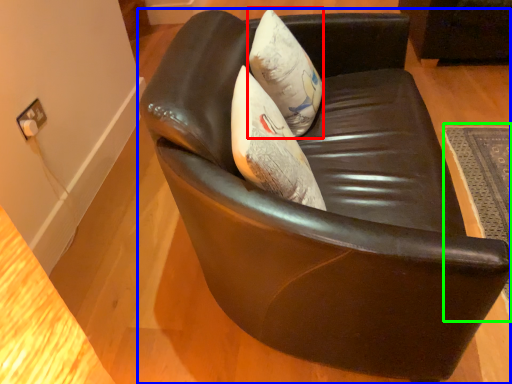
Question: Estimate the real-world distances between objects in this image. Which object is closer to throw pillow (highlighted by a red box), chair (highlighted by a blue box) or mat (highlighted by a green box)?

Choices:
 (A) chair
 (B) mat

Answer: (A)